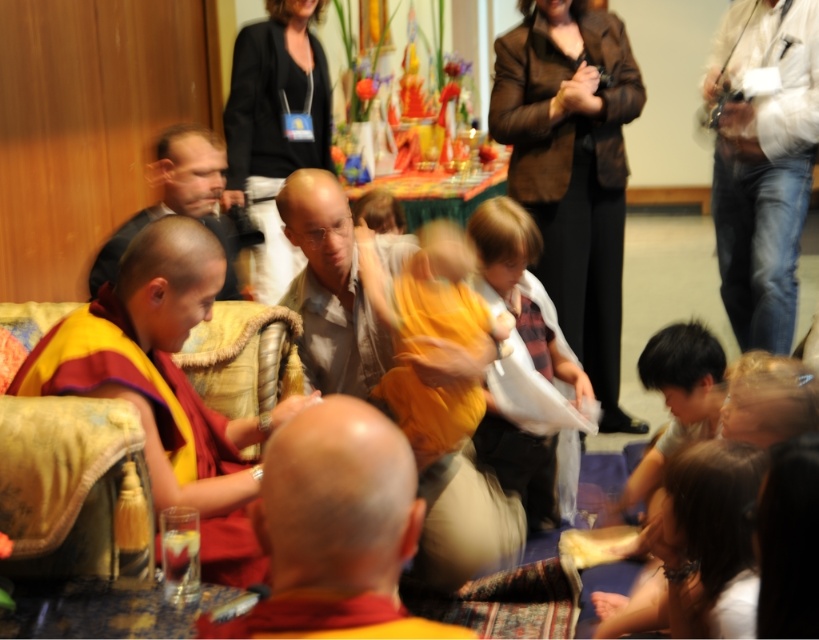
You are organizing a photo shoot and need to ensure that the red robe monk at left and the white cotton shirt at right are framed properly. Based on their sizes in the image, which one requires a larger area in the frame?

The white cotton shirt at right requires a larger area in the frame because the red robe monk at left occupies less space than the white cotton shirt at right.